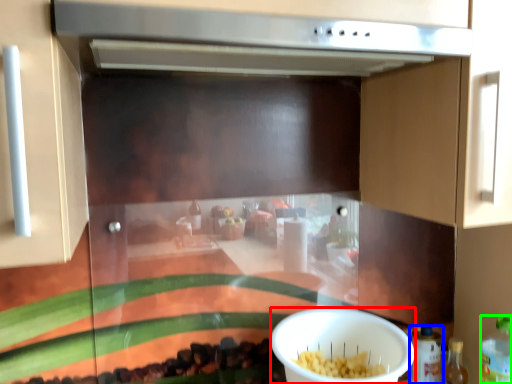
Question: Which is farther away from bowl (highlighted by a red box)? bottle (highlighted by a blue box) or bottle (highlighted by a green box)?

Choices:
 (A) bottle
 (B) bottle

Answer: (B)